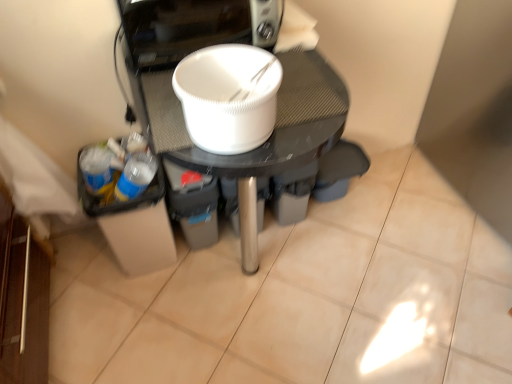
Question: Is white matte bowl at center positioned behind white matte bowl at center?

Choices:
 (A) yes
 (B) no

Answer: (A)

Question: From a real-world perspective, is white matte bowl at center under white matte bowl at center?

Choices:
 (A) no
 (B) yes

Answer: (B)

Question: Can you confirm if white matte bowl at center is positioned to the right of white matte bowl at center?

Choices:
 (A) yes
 (B) no

Answer: (B)

Question: From a real-world perspective, is white matte bowl at center on white matte bowl at center?

Choices:
 (A) yes
 (B) no

Answer: (B)

Question: Is white matte bowl at center touching white matte bowl at center?

Choices:
 (A) yes
 (B) no

Answer: (A)

Question: Is white matte bowl at center not within white matte bowl at center?

Choices:
 (A) yes
 (B) no

Answer: (A)

Question: From a real-world perspective, is white matte bowl at center located beneath white matte bowl at center?

Choices:
 (A) no
 (B) yes

Answer: (A)

Question: From a real-world perspective, is white matte bowl at center on white matte bowl at center?

Choices:
 (A) yes
 (B) no

Answer: (A)

Question: Can you confirm if white matte bowl at center is wider than white matte bowl at center?

Choices:
 (A) yes
 (B) no

Answer: (B)

Question: Can you confirm if white matte bowl at center is smaller than white matte bowl at center?

Choices:
 (A) yes
 (B) no

Answer: (A)

Question: Is white matte bowl at center far from white matte bowl at center?

Choices:
 (A) no
 (B) yes

Answer: (A)

Question: Is white matte bowl at center surrounding white matte bowl at center?

Choices:
 (A) no
 (B) yes

Answer: (A)

Question: In terms of width, does white matte bowl at center look wider or thinner when compared to white matte bowl at center?

Choices:
 (A) thin
 (B) wide

Answer: (A)